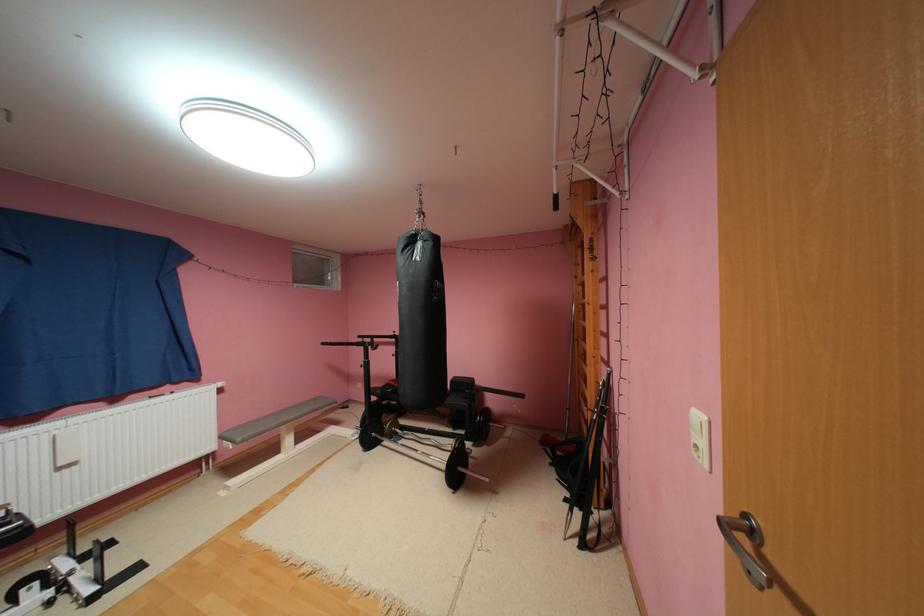
The height and width of the screenshot is (616, 924). Describe the element at coordinates (590, 496) in the screenshot. I see `the black bar grip` at that location.